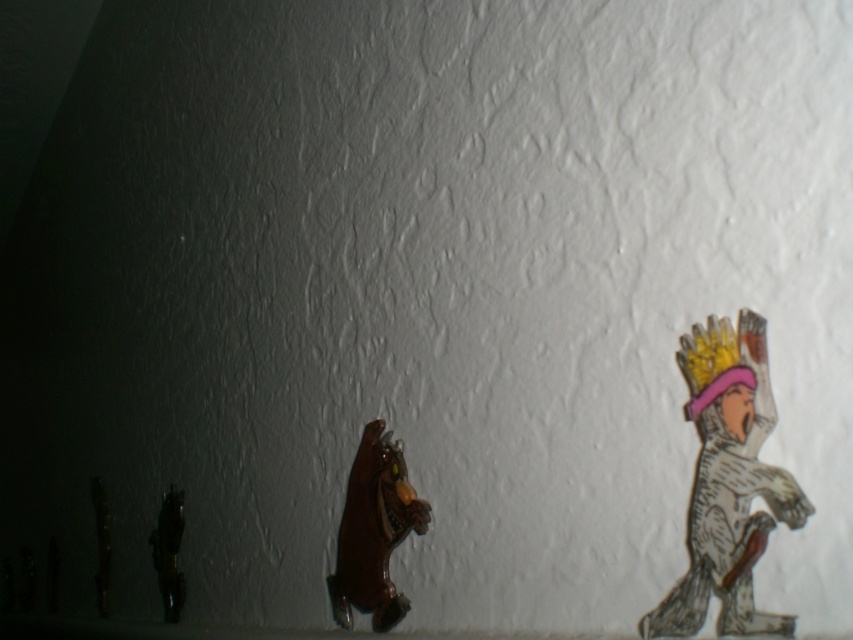
You are standing in front of the wall with the two figures. There is a point at coordinates (374, 531). What object is located at that point?

The brown glossy bear at center is located at point (374, 531).

You are an interior designer arranging a shelf and need to place the brown glossy bear at center and the shiny black figurine at left. The shelf is 20 inches wide. Can both items fit side by side without overlapping?

The brown glossy bear at center is 17.99 inches from the shiny black figurine at left. Since the shelf is 20 inches wide, there is enough space between them to fit both items side by side without overlapping.

Please provide the coordinates of the brown glossy bear at center in the image.

The brown glossy bear at center is located at coordinates point (374, 531).